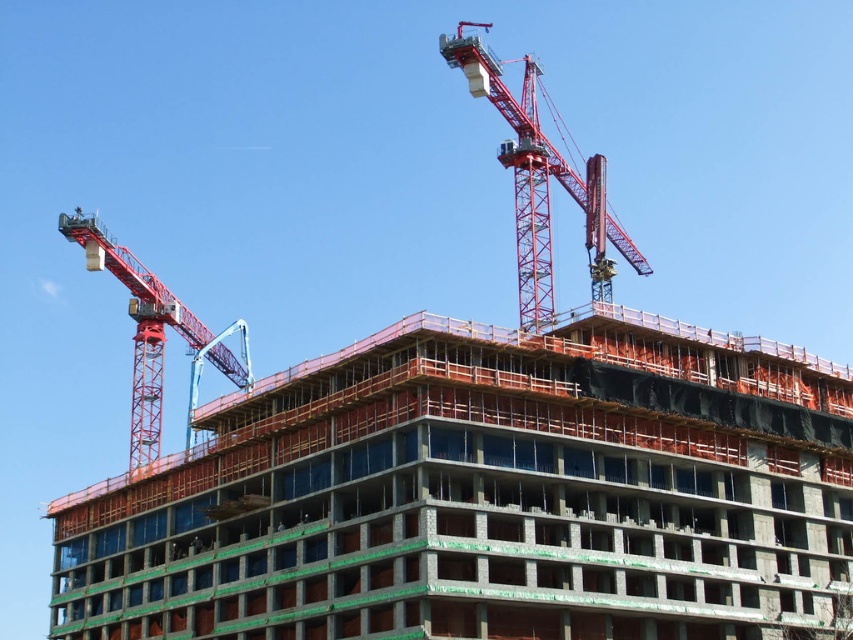
Does concrete at center appear under metallic red crane at upper left?

Yes.

At what (x,y) coordinates should I click in order to perform the action: click on concrete at center. Please return your answer as a coordinate pair (x, y). This screenshot has height=640, width=853. Looking at the image, I should click on (485, 493).

Identify the location of concrete at center. The width and height of the screenshot is (853, 640). (485, 493).

Does red metallic crane at upper center appear under metal construction worker at upper left?

Incorrect, red metallic crane at upper center is not positioned below metal construction worker at upper left.

Does point (550, 282) lie behind point (74, 212)?

No.

Which is behind, point (525, 145) or point (78, 218)?

The point (78, 218) is more distant.

Where is `red metallic crane at upper center`? Image resolution: width=853 pixels, height=640 pixels. red metallic crane at upper center is located at coordinates (540, 182).

Is concrete at center taller than metal construction worker at upper left?

Yes.

Does point (70, 499) come behind point (80, 212)?

No.

Who is more forward, (x=437, y=595) or (x=67, y=220)?

Positioned in front is point (x=437, y=595).

Identify the location of concrete at center. This screenshot has height=640, width=853. (485, 493).